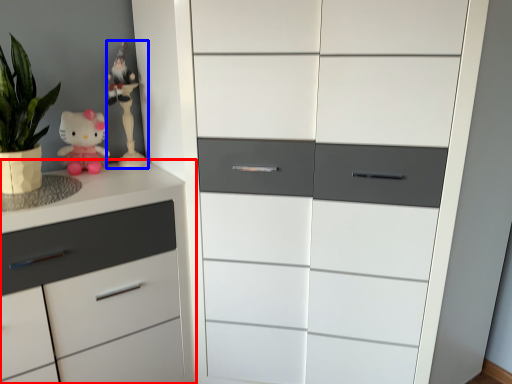
Question: Among these objects, which one is nearest to the camera, chest of drawers (highlighted by a red box) or miniature (highlighted by a blue box)?

Choices:
 (A) chest of drawers
 (B) miniature

Answer: (A)